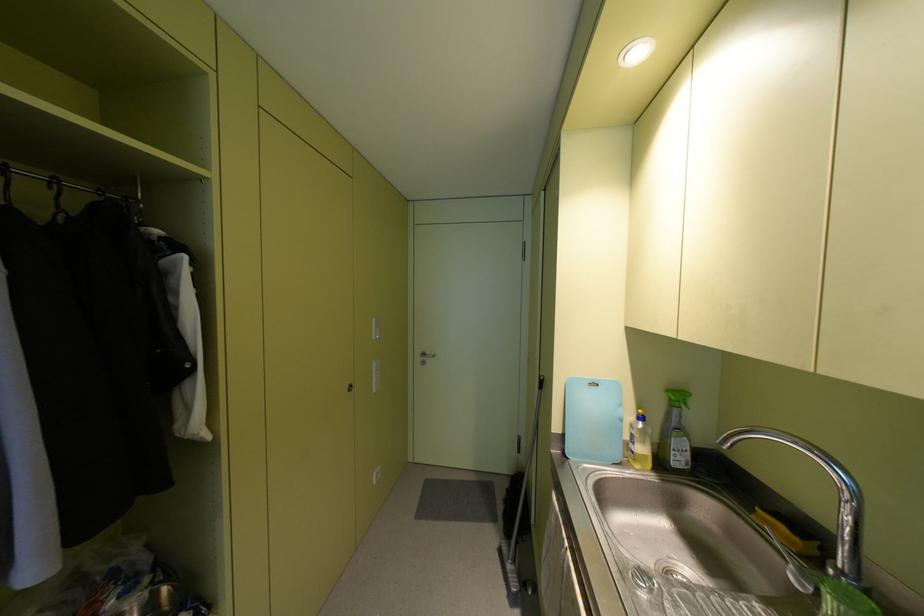
Find the location of a particular element. The height and width of the screenshot is (616, 924). silver door handle is located at coordinates (420, 357).